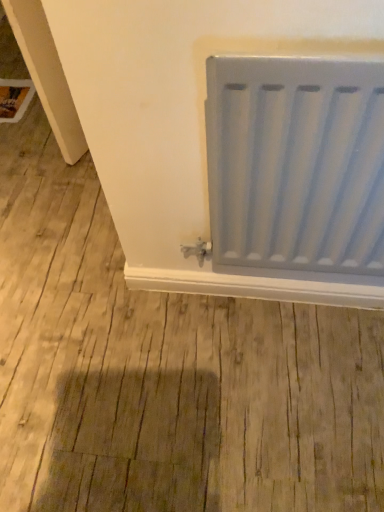
Where is `vacant region under satin white radiator at right (from a real-world perspective)`? This screenshot has height=512, width=384. vacant region under satin white radiator at right (from a real-world perspective) is located at coordinates (269, 313).